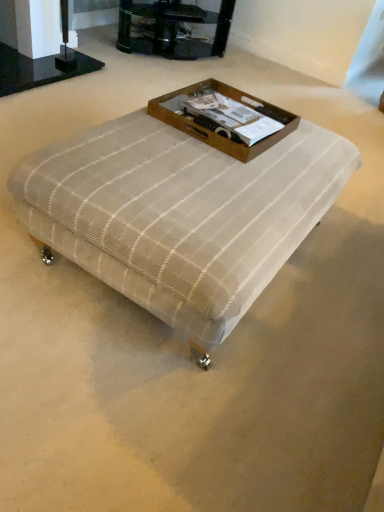
I want to click on vacant area that is in front of brown wooden tray at center, so click(199, 173).